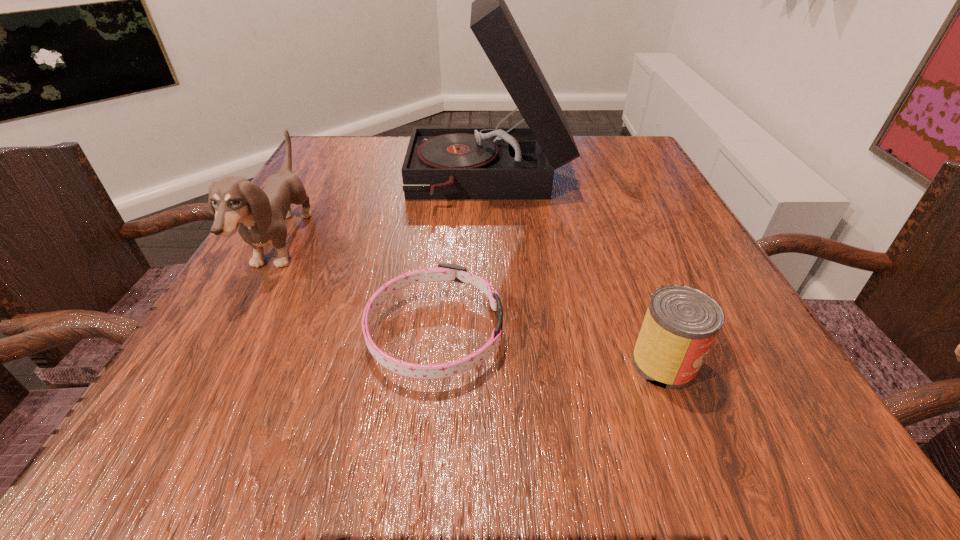
At what (x,y) coordinates should I click in order to perform the action: click on free space located 0.250m with the buckle on the shortest object. Please return your answer as a coordinate pair (x, y). The height and width of the screenshot is (540, 960). Looking at the image, I should click on (679, 333).

This screenshot has height=540, width=960. I want to click on object present at the far edge, so 513,163.

Locate an element on the screen. can located at the near edge is located at coordinates (681, 323).

Locate an element on the screen. This screenshot has width=960, height=540. dog collar at the near edge is located at coordinates (444, 272).

In order to click on object at the left edge in this screenshot , I will do `click(258, 215)`.

You are a GUI agent. You are given a task and a screenshot of the screen. Output one action in this format:
    pyautogui.click(x=<x>, y=<y>)
    Task: Click on the object at the right edge
    Image resolution: width=960 pixels, height=540 pixels.
    Given the screenshot: What is the action you would take?
    [681, 323]

Find the location of a particular element. object that is at the near right corner is located at coordinates (681, 323).

This screenshot has width=960, height=540. Find the location of `vacant space at the near edge of the desktop`. vacant space at the near edge of the desktop is located at coordinates (620, 406).

I want to click on vacant space at the left edge of the desktop, so click(364, 199).

Locate an element on the screen. vacant space at the right edge is located at coordinates click(710, 388).